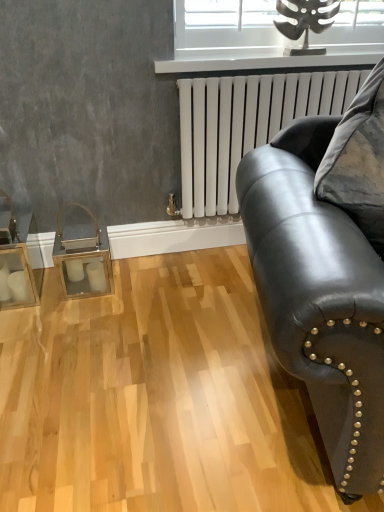
Where is `free location above white glossy radiator at upper center (from a real-world perspective)`? The height and width of the screenshot is (512, 384). free location above white glossy radiator at upper center (from a real-world perspective) is located at coordinates (277, 54).